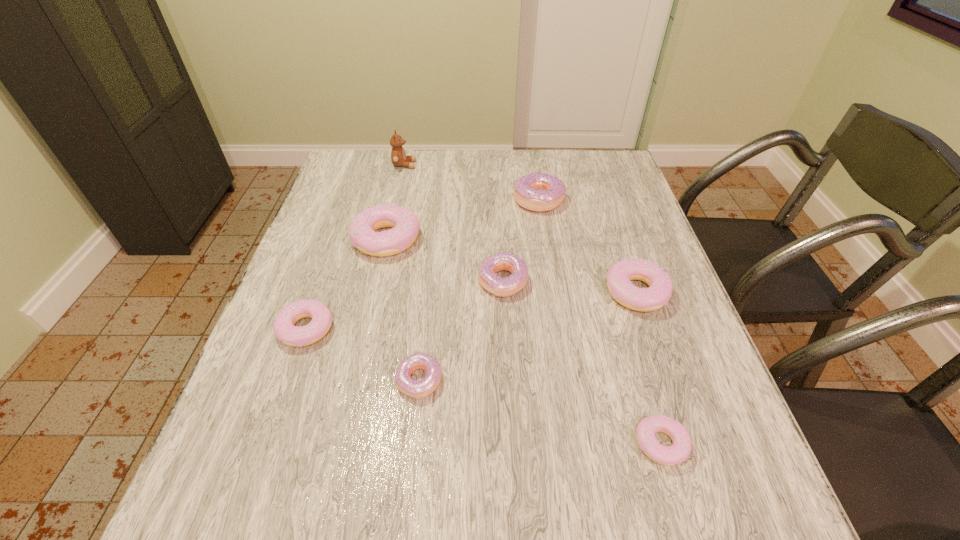
At what (x,y) coordinates should I click in order to perform the action: click on free space that is in between the biggest purple doughnut and the farthest object. Please return your answer as a coordinate pair (x, y). Image resolution: width=960 pixels, height=540 pixels. Looking at the image, I should click on pyautogui.click(x=471, y=182).

Locate an element on the screen. free space that is in between the shortest object and the sixth nearest object is located at coordinates click(x=523, y=341).

At what (x,y) coordinates should I click in order to perform the action: click on free space between the sixth farthest doughnut and the third smallest pink doughnut. Please return your answer as a coordinate pair (x, y). The width and height of the screenshot is (960, 540). Looking at the image, I should click on (528, 336).

Where is `empty space between the smallest purple doughnut and the second nearest purple doughnut`? This screenshot has width=960, height=540. empty space between the smallest purple doughnut and the second nearest purple doughnut is located at coordinates (461, 331).

Where is `empty space that is in between the smallest pink doughnut and the second smallest pink doughnut`? This screenshot has height=540, width=960. empty space that is in between the smallest pink doughnut and the second smallest pink doughnut is located at coordinates (484, 386).

The image size is (960, 540). I want to click on free spot between the third smallest pink doughnut and the second smallest purple doughnut, so click(569, 287).

You are a GUI agent. You are given a task and a screenshot of the screen. Output one action in this format:
    pyautogui.click(x=<x>, y=<y>)
    Task: Click on the free spot between the shortest object and the brown teddy bear
    
    Given the screenshot: What is the action you would take?
    pyautogui.click(x=533, y=305)

The height and width of the screenshot is (540, 960). In order to click on unoccupied area between the second nearest object and the brown teddy bear in this screenshot , I will do `click(412, 273)`.

Identify the location of object that ranks as the fourth closest to the second smallest purple doughnut. This screenshot has width=960, height=540. (540, 192).

The width and height of the screenshot is (960, 540). Find the location of `the second closest object relative to the farthest pink doughnut`. the second closest object relative to the farthest pink doughnut is located at coordinates (285, 331).